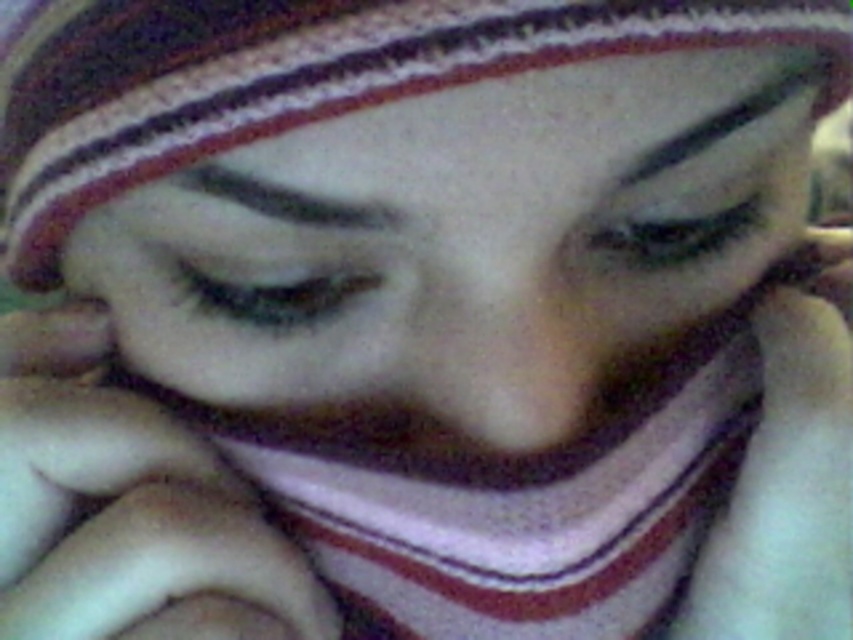
Based on the scene description, where is the matte white face at center located in the image?

The matte white face at center is located at point (x=463, y=252) in the image.

In the scene shown: You are an artist trying to sketch this scene. You need to decide the order to draw the points so that the one closer to the viewer is drawn first. Which point should you draw first, point (613,131) or point (759,328)?

Point (613,131) should be drawn first because it is in front of point (759,328).

Based on the scene description, what is located at the coordinates point [463,252]?

The point [463,252] is where the matte white face at center is located.